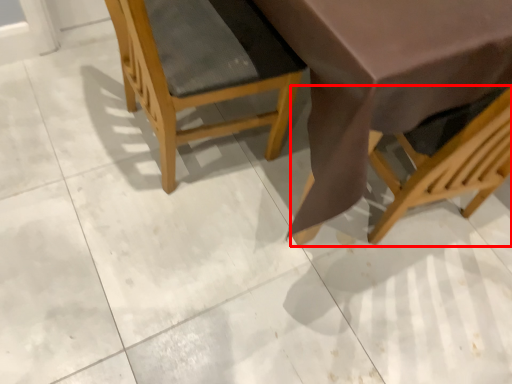
Question: From the image's perspective, what is the correct spatial relationship of chair (annotated by the red box) in relation to chair?

Choices:
 (A) below
 (B) above

Answer: (A)